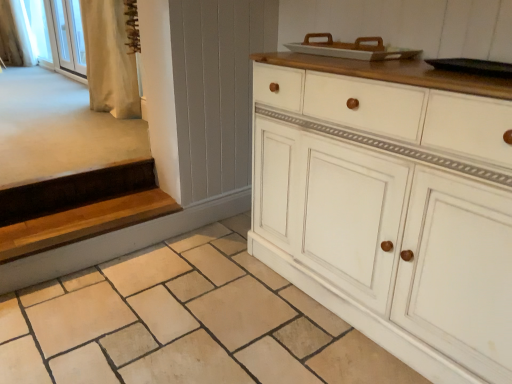
Question: Would you say white glass screen door at upper left is a long distance from white fabric curtain at upper left, positioned as the 1th curtain in left-to-right order?

Choices:
 (A) yes
 (B) no

Answer: (A)

Question: Is white glass screen door at upper left shorter than white fabric curtain at upper left, which is counted as the 2th curtain, starting from the bottom?

Choices:
 (A) yes
 (B) no

Answer: (A)

Question: Is white glass screen door at upper left further to camera compared to white fabric curtain at upper left, the 1th curtain in the back-to-front sequence?

Choices:
 (A) yes
 (B) no

Answer: (B)

Question: Does white glass screen door at upper left have a lesser width compared to white fabric curtain at upper left, the 1th curtain in the back-to-front sequence?

Choices:
 (A) yes
 (B) no

Answer: (A)

Question: Could you tell me if white glass screen door at upper left is turned towards white fabric curtain at upper left, which is counted as the 1th curtain, starting from the top?

Choices:
 (A) no
 (B) yes

Answer: (A)

Question: Would you say wooden at left is inside or outside natural stone tile at lower center?

Choices:
 (A) outside
 (B) inside

Answer: (A)

Question: Considering the positions of point (93, 220) and point (218, 306), is point (93, 220) closer or farther from the camera than point (218, 306)?

Choices:
 (A) farther
 (B) closer

Answer: (A)

Question: Looking at their shapes, would you say wooden at left is wider or thinner than natural stone tile at lower center?

Choices:
 (A) thin
 (B) wide

Answer: (A)

Question: Looking at the image, does wooden at left seem bigger or smaller compared to natural stone tile at lower center?

Choices:
 (A) small
 (B) big

Answer: (A)

Question: Considering the positions of white fabric at upper left and white glass screen door at upper left in the image, is white fabric at upper left taller or shorter than white glass screen door at upper left?

Choices:
 (A) tall
 (B) short

Answer: (A)

Question: In terms of size, does white fabric at upper left appear bigger or smaller than white glass screen door at upper left?

Choices:
 (A) big
 (B) small

Answer: (A)

Question: Is white fabric at upper left in front of or behind white glass screen door at upper left in the image?

Choices:
 (A) front
 (B) behind

Answer: (B)

Question: From the image's perspective, is white fabric at upper left positioned above or below white glass screen door at upper left?

Choices:
 (A) below
 (B) above

Answer: (B)

Question: From the image's perspective, is white fabric curtain at upper left, the 1th curtain in the back-to-front sequence, located above or below white painted wood cabinet at center?

Choices:
 (A) above
 (B) below

Answer: (A)

Question: Relative to white painted wood cabinet at center, is white fabric curtain at upper left, which is counted as the second curtain, starting from the front, in front or behind?

Choices:
 (A) behind
 (B) front

Answer: (A)